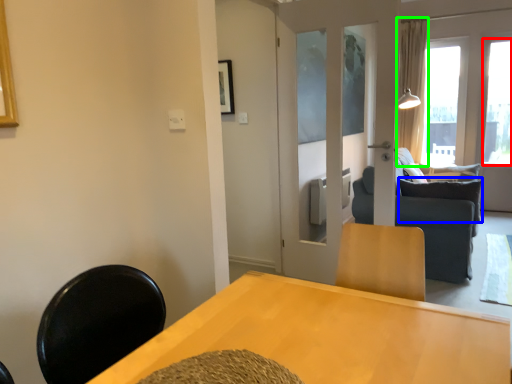
Question: Which is nearer to the window (highlighted by a red box)? pillow (highlighted by a blue box) or curtain (highlighted by a green box).

Choices:
 (A) pillow
 (B) curtain

Answer: (B)